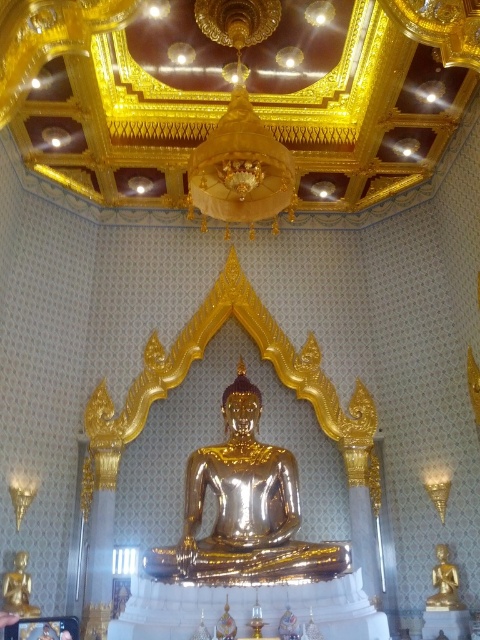
Who is positioned more to the left, gold shiny statue at center or gold shiny statue at lower right?

From the viewer's perspective, gold shiny statue at center appears more on the left side.

Is gold shiny statue at center smaller than gold shiny statue at lower right?

No.

I want to click on gold shiny statue at center, so click(244, 509).

Is gold polished statue at lower left further to the viewer compared to gold shiny statue at lower right?

No, it is not.

Between gold polished statue at lower left and gold shiny statue at lower right, which one is positioned lower?

gold shiny statue at lower right

Does point (17, 611) come behind point (442, 545)?

No, (17, 611) is closer to viewer.

Where is `gold polished statue at lower left`? The width and height of the screenshot is (480, 640). gold polished statue at lower left is located at coordinates (19, 588).

Who is shorter, gold shiny statue at center or gold polished statue at lower left?

gold polished statue at lower left is shorter.

Does gold shiny statue at center have a smaller size compared to gold polished statue at lower left?

Incorrect, gold shiny statue at center is not smaller in size than gold polished statue at lower left.

In the scene shown: Who is more forward, [224,420] or [14,557]?

Point [14,557]

Identify the location of gold shiny statue at center. Image resolution: width=480 pixels, height=640 pixels. (244, 509).